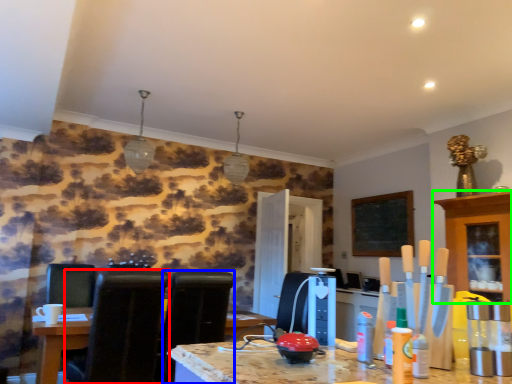
Question: Which object is positioned closest to chair (highlighted by a red box)? Select from chair (highlighted by a blue box) and cabinetry (highlighted by a green box).

Choices:
 (A) chair
 (B) cabinetry

Answer: (A)